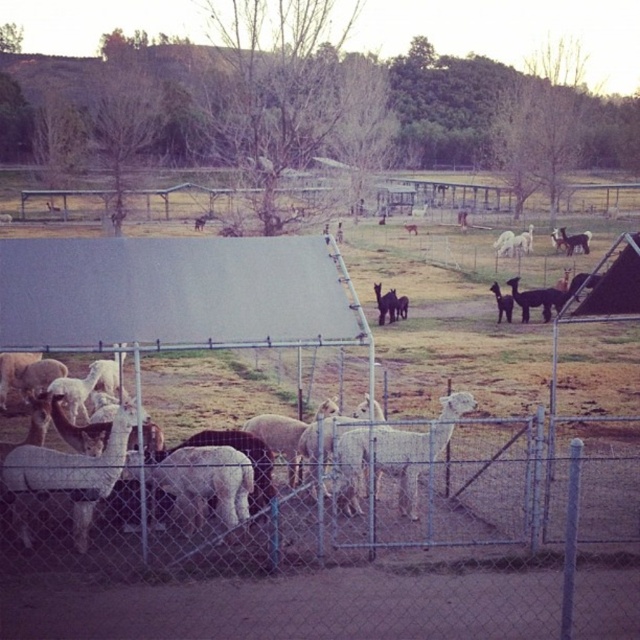
Question: Can you confirm if white woolly alpaca at lower left is positioned below white woolly alpaca at center?

Choices:
 (A) yes
 (B) no

Answer: (A)

Question: Does white woolly alpaca at lower left have a smaller size compared to white woolly alpaca at center?

Choices:
 (A) yes
 (B) no

Answer: (A)

Question: Which point is farther from the camera taking this photo?

Choices:
 (A) (61, 464)
 (B) (384, 449)

Answer: (B)

Question: Can you confirm if white woolly alpaca at lower left is thinner than white woolly alpaca at center?

Choices:
 (A) yes
 (B) no

Answer: (B)

Question: Which point is farther from the camera taking this photo?

Choices:
 (A) (83, 465)
 (B) (417, 456)

Answer: (B)